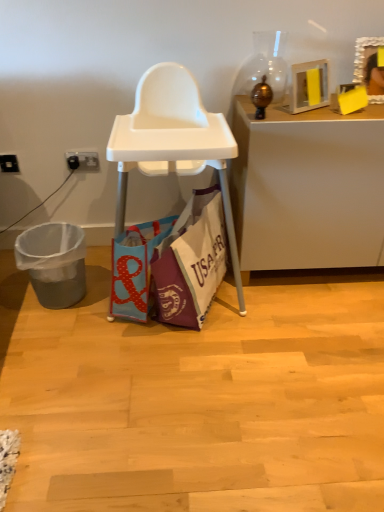
You are a GUI agent. You are given a task and a screenshot of the screen. Output one action in this format:
    pyautogui.click(x=<x>, y=<y>)
    Task: Click on the vacant space in front of white plastic high chair at center
    Image resolution: width=384 pixels, height=512 pixels.
    Given the screenshot: What is the action you would take?
    pyautogui.click(x=179, y=377)